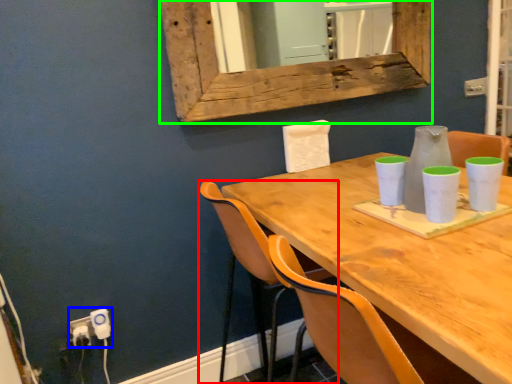
Question: Which object is positioned closest to chair (highlighted by a red box)? Select from electric outlet (highlighted by a blue box) and window frame (highlighted by a green box).

Choices:
 (A) electric outlet
 (B) window frame

Answer: (B)